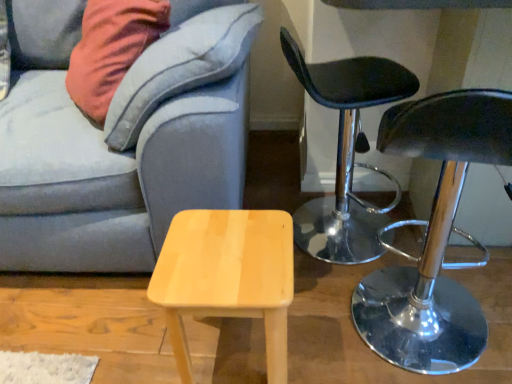
Question: Is black leather stool at right, which ranks as the first chair in back-to-front order, facing towards shiny chrome stool at right, which ranks as the second chair in back-to-front order?

Choices:
 (A) yes
 (B) no

Answer: (B)

Question: Considering the relative sizes of black leather stool at right, which is counted as the 2th chair, starting from the front, and shiny chrome stool at right, which is counted as the 1th chair, starting from the front, in the image provided, is black leather stool at right, which is counted as the 2th chair, starting from the front, bigger than shiny chrome stool at right, which is counted as the 1th chair, starting from the front,?

Choices:
 (A) yes
 (B) no

Answer: (A)

Question: From the image's perspective, is black leather stool at right, which ranks as the first chair in back-to-front order, below shiny chrome stool at right, which ranks as the second chair in back-to-front order?

Choices:
 (A) yes
 (B) no

Answer: (B)

Question: Does black leather stool at right, which ranks as the first chair in back-to-front order, have a smaller size compared to shiny chrome stool at right, which is counted as the 1th chair, starting from the front?

Choices:
 (A) no
 (B) yes

Answer: (A)

Question: Is black leather stool at right, which ranks as the first chair in back-to-front order, in front of shiny chrome stool at right, which ranks as the second chair in back-to-front order?

Choices:
 (A) yes
 (B) no

Answer: (B)

Question: Considering their positions, is shiny chrome stool at right, which is counted as the 1th chair, starting from the front, located in front of or behind light wood stool at center?

Choices:
 (A) front
 (B) behind

Answer: (A)

Question: Considering the positions of shiny chrome stool at right, which ranks as the second chair in back-to-front order, and light wood stool at center in the image, is shiny chrome stool at right, which ranks as the second chair in back-to-front order, bigger or smaller than light wood stool at center?

Choices:
 (A) big
 (B) small

Answer: (A)

Question: Is shiny chrome stool at right, which is counted as the 1th chair, starting from the front, taller or shorter than light wood stool at center?

Choices:
 (A) short
 (B) tall

Answer: (B)

Question: Is shiny chrome stool at right, which ranks as the second chair in back-to-front order, to the left or to the right of light wood stool at center in the image?

Choices:
 (A) right
 (B) left

Answer: (A)

Question: Is black leather stool at right, which is counted as the 2th chair, starting from the front, to the left or to the right of light wood stool at center in the image?

Choices:
 (A) right
 (B) left

Answer: (A)

Question: Is black leather stool at right, which ranks as the first chair in back-to-front order, wider or thinner than light wood stool at center?

Choices:
 (A) wide
 (B) thin

Answer: (A)

Question: From the image's perspective, relative to light wood stool at center, is black leather stool at right, which ranks as the first chair in back-to-front order, above or below?

Choices:
 (A) below
 (B) above

Answer: (B)

Question: Is black leather stool at right, which ranks as the first chair in back-to-front order, taller or shorter than light wood stool at center?

Choices:
 (A) short
 (B) tall

Answer: (B)

Question: Considering the positions of velvet gray couch at lower left and shiny chrome stool at right, which ranks as the second chair in back-to-front order, in the image, is velvet gray couch at lower left wider or thinner than shiny chrome stool at right, which ranks as the second chair in back-to-front order,?

Choices:
 (A) wide
 (B) thin

Answer: (A)

Question: In terms of size, does velvet gray couch at lower left appear bigger or smaller than shiny chrome stool at right, which ranks as the second chair in back-to-front order?

Choices:
 (A) small
 (B) big

Answer: (B)